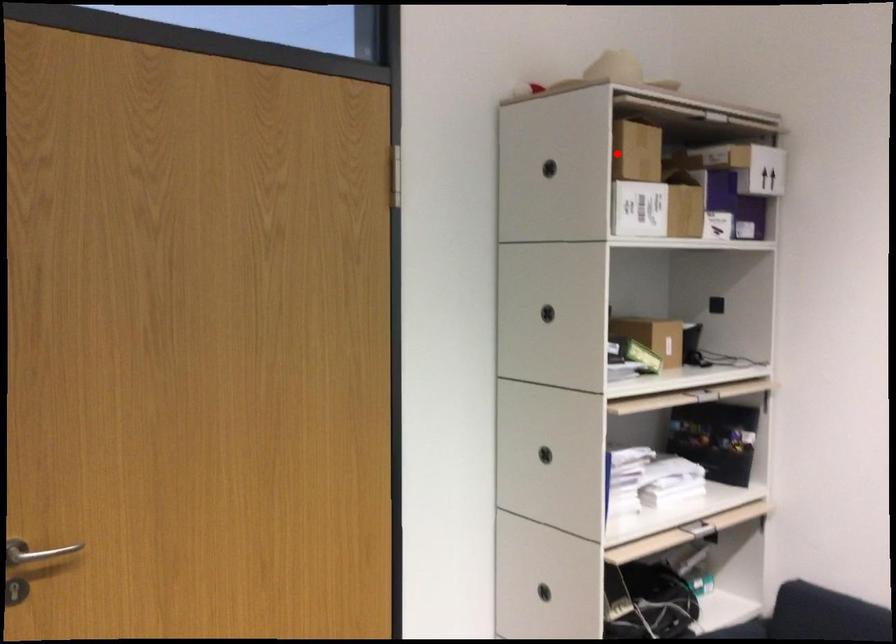
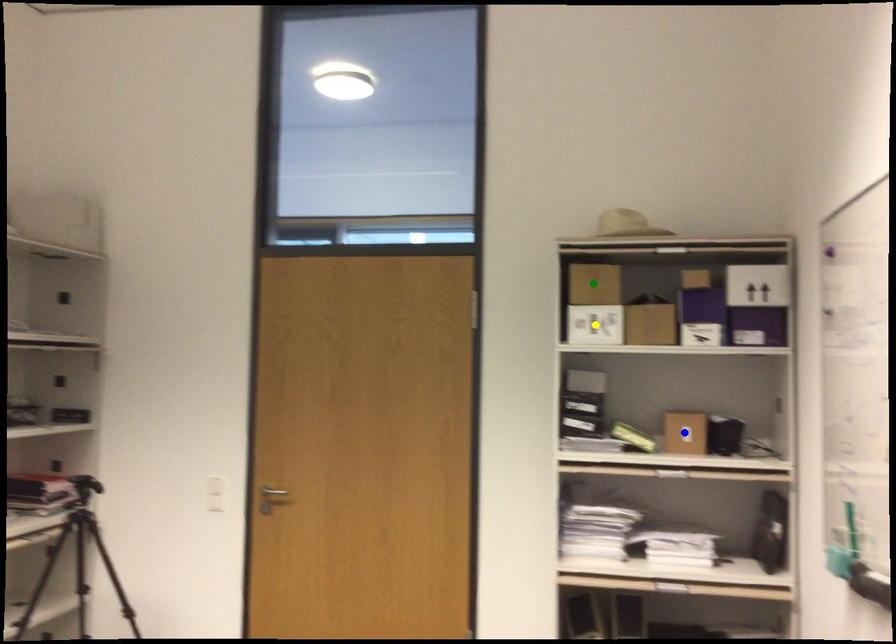
Question: I am providing you with two images of the same scene from different viewpoints. A red point is marked on the first image. You are given multiple points on the second image. In image 2, which mark is for the same physical point as the one in image 1?

Choices:
 (A) blue point
 (B) green point
 (C) yellow point

Answer: (B)